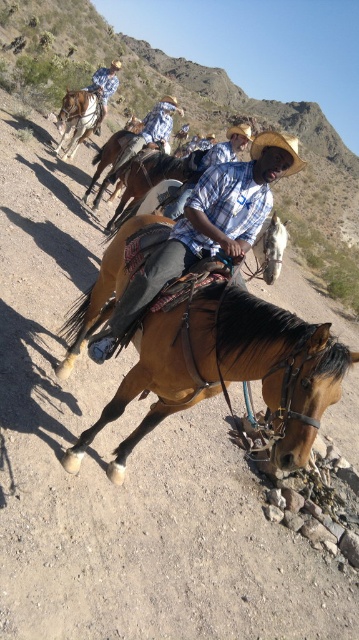
Question: Does brown leather horse at center have a larger size compared to matte blue plaid shirt at center?

Choices:
 (A) yes
 (B) no

Answer: (A)

Question: Is brown leather saddle at center to the left of light blue plaid shirt at center from the viewer's perspective?

Choices:
 (A) no
 (B) yes

Answer: (A)

Question: Does brown leather horse at center appear on the left side of brown leather saddle at upper left?

Choices:
 (A) yes
 (B) no

Answer: (B)

Question: Considering the real-world distances, which object is farthest from the matte blue plaid shirt at center?

Choices:
 (A) brown leather saddle at center
 (B) light blue plaid shirt at center
 (C) brown leather saddle at upper left
 (D) brown leather horse at center

Answer: (D)

Question: Based on their relative distances, which object is nearer to the brown leather saddle at center?

Choices:
 (A) brown leather saddle at upper left
 (B) matte blue plaid shirt at center

Answer: (B)

Question: Which of the following is the closest to the observer?

Choices:
 (A) brown leather saddle at upper left
 (B) brown leather saddle at center

Answer: (B)